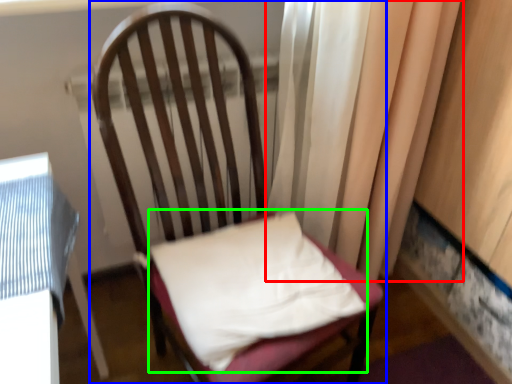
Question: Considering the real-world distances, which object is closest to curtain (highlighted by a red box)? chair (highlighted by a blue box) or pillow (highlighted by a green box).

Choices:
 (A) chair
 (B) pillow

Answer: (A)